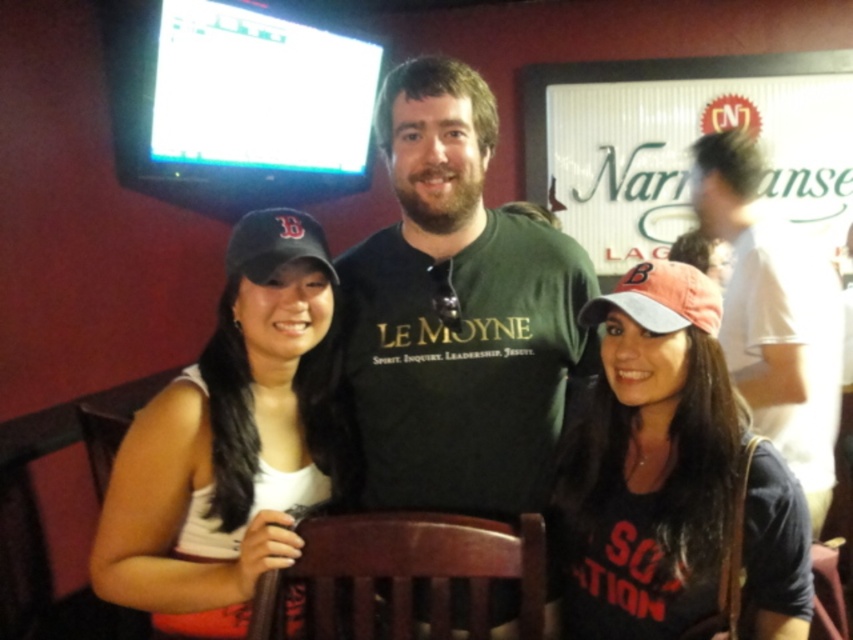
You are trying to decide which cap to wear for a casual outing. You see a white matte baseball cap at left and a pink fabric cap at center. Which one is located more to the left?

The white matte baseball cap at left is more to the left than the pink fabric cap at center.